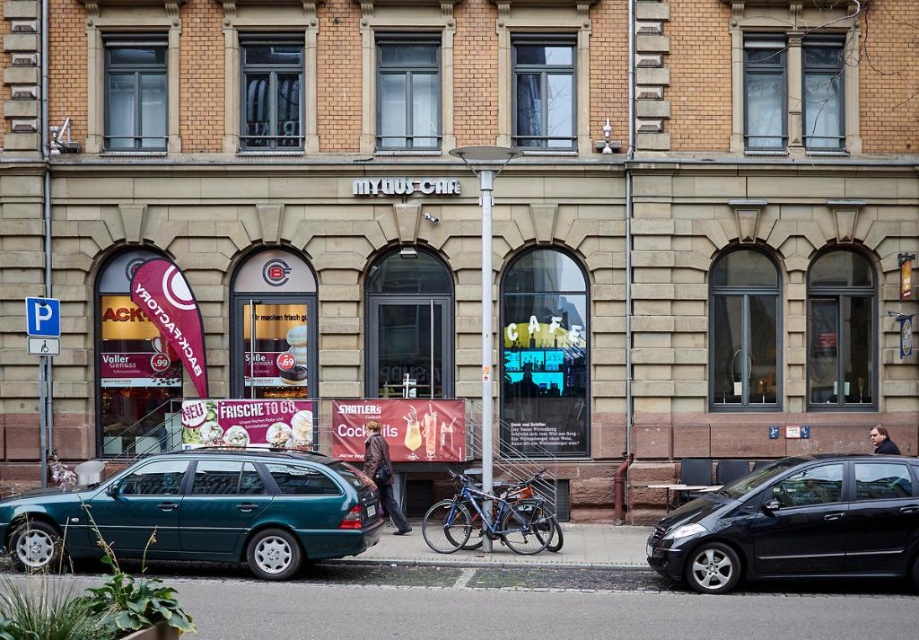
You are standing in front of the MYQUUS CAFE and want to park your teal metallic station wagon at lower left. The parking spot is located at point (202, 513). Can you park your car there?

Yes, the teal metallic station wagon at lower left is already located at point (202, 513), so it is parked there.

Based on the photo, you are a pedestrian standing in front of the MYQUUS CAF? building. You see a teal metallic station wagon at lower left and a black matte car at right. Which car is closer to you?

Result: The teal metallic station wagon at lower left is closer to you because it is positioned over the black matte car at right, indicating it is in front.

You are a delivery person needing to park your 2.5 meters wide van between the teal metallic station wagon at lower left and the black matte car at right. Can you fit your van there?

The teal metallic station wagon at lower left is wider than the black matte car at right. Therefore, the space between them may not be sufficient for a 2.5 meters wide van, as the total available space depends on their combined widths. However, since the teal wagon is wider, the gap might be narrower than required. It is advisable to check the exact dimensions before attempting to park.